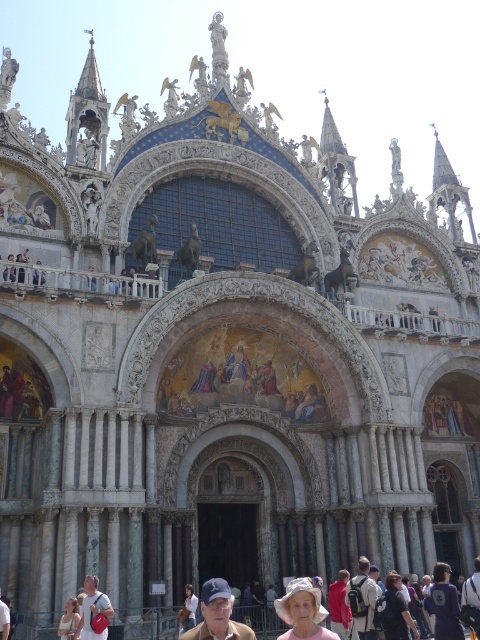
Question: Is blue fabric cap at lower center above pink fabric at lower left?

Choices:
 (A) no
 (B) yes

Answer: (A)

Question: Among these objects, which one is nearest to the camera?

Choices:
 (A) pink fabric at lower center
 (B) blue fabric cap at lower center
 (C) red cotton shirt at center
 (D) matte pink backpack at lower left

Answer: (B)

Question: Does blue fabric shirt at center have a greater width compared to pink fabric at lower center?

Choices:
 (A) yes
 (B) no

Answer: (A)

Question: Which object is the farthest from the pink fabric at lower left?

Choices:
 (A) blue fabric shirt at center
 (B) blue fabric cap at lower center
 (C) pink fabric at lower center

Answer: (A)

Question: From the image, what is the correct spatial relationship of blue fabric cap at lower center in relation to pink fabric at lower left?

Choices:
 (A) right
 (B) left

Answer: (A)

Question: Which is farther from the blue fabric cap at lower center?

Choices:
 (A) pink fabric at lower left
 (B) pink fabric at lower center
 (C) light beige fabric hat at lower center

Answer: (B)